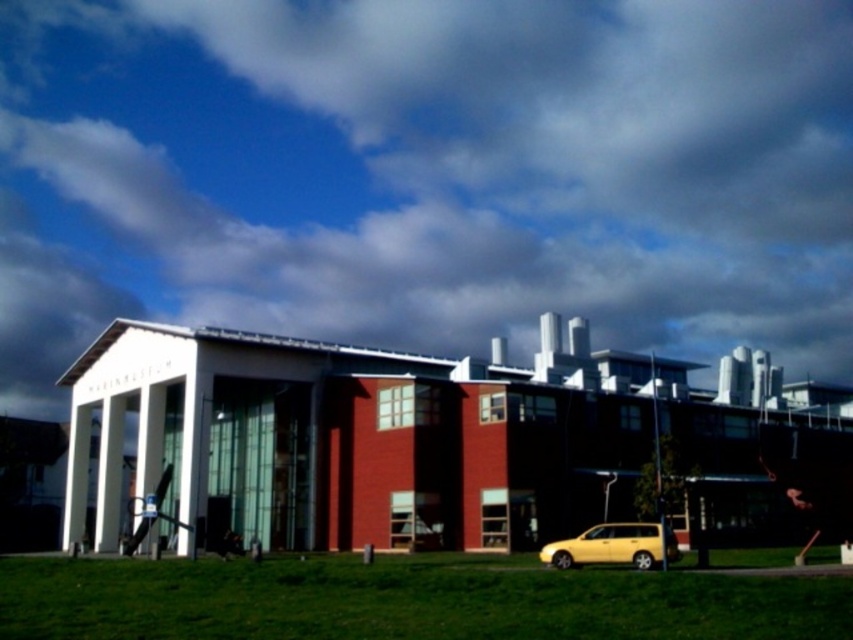
Question: Does cloudy sky at upper center have a greater width compared to yellow matte car at lower right?

Choices:
 (A) yes
 (B) no

Answer: (A)

Question: Is white glass building at center above yellow matte car at lower right?

Choices:
 (A) no
 (B) yes

Answer: (B)

Question: Which of the following is the closest to the observer?

Choices:
 (A) (564, 150)
 (B) (62, 630)
 (C) (142, 438)

Answer: (B)

Question: Which object is the closest to the green grass at lower center?

Choices:
 (A) yellow matte car at lower right
 (B) cloudy sky at upper center

Answer: (A)

Question: Which object is positioned farthest from the cloudy sky at upper center?

Choices:
 (A) yellow matte car at lower right
 (B) green grass at lower center
 (C) white glass building at center

Answer: (A)

Question: Is cloudy sky at upper center above yellow matte car at lower right?

Choices:
 (A) yes
 (B) no

Answer: (A)